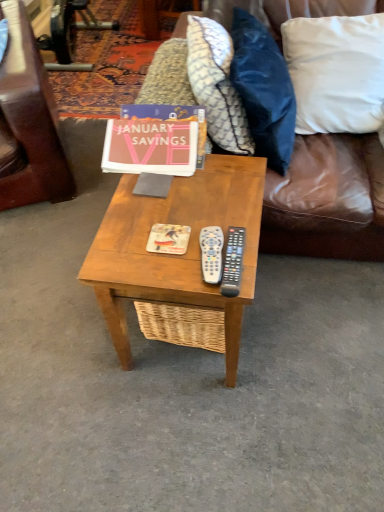
The image size is (384, 512). Find the location of `vacant space that is to the left of woodenwoodencoffee table at center`. vacant space that is to the left of woodenwoodencoffee table at center is located at coordinates (61, 336).